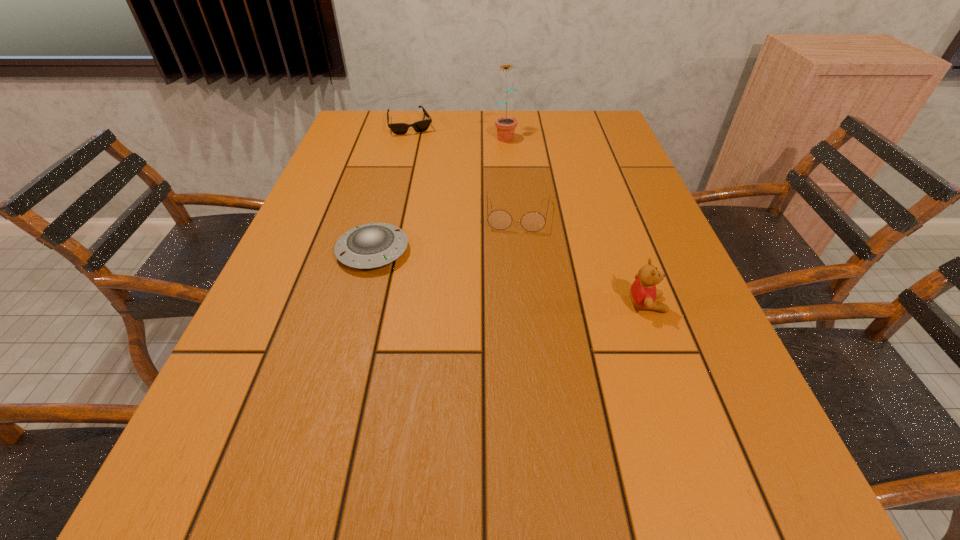
I want to click on vacant space on the desktop that is between the saucer and the teddy bear and is positioned on the flower of the sunflower, so click(541, 284).

I want to click on vacant spot on the desktop that is between the saucer and the nearest object and is positioned on the temples of the third tallest object, so click(516, 279).

This screenshot has height=540, width=960. I want to click on free space on the desktop that is between the saucer and the second tallest object and is positioned on the front-facing side of the sunglasses, so click(464, 268).